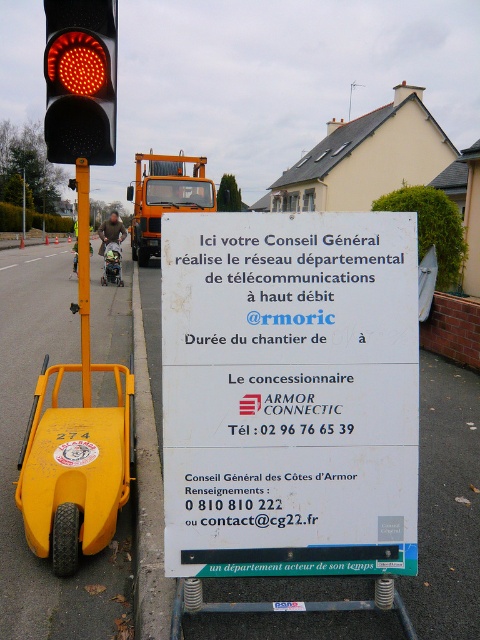
You are a delivery driver approaching the construction site. You see two points marked on the signboard at coordinates point (x=370, y=451) and point (x=130, y=445). Which point is closer to you as you face the signboard?

Point (x=370, y=451) is in front of point (x=130, y=445), so it is closer to you as you face the signboard.

You are a child playing with the yellow matte toy car at lower left and want to drive it towards the matte black traffic light at upper left. Can the car reach the traffic light without going behind it?

The yellow matte toy car at lower left is in front of the matte black traffic light at upper left, so the car can drive towards the traffic light without needing to go behind it.

You are a pedestrian standing on the sidewalk looking at the street scene. You see the matte black traffic light at upper left and the yellow plastic pole at left. Which object is closer to you?

The matte black traffic light at upper left is closer to you because it is in front of the yellow plastic pole at left.